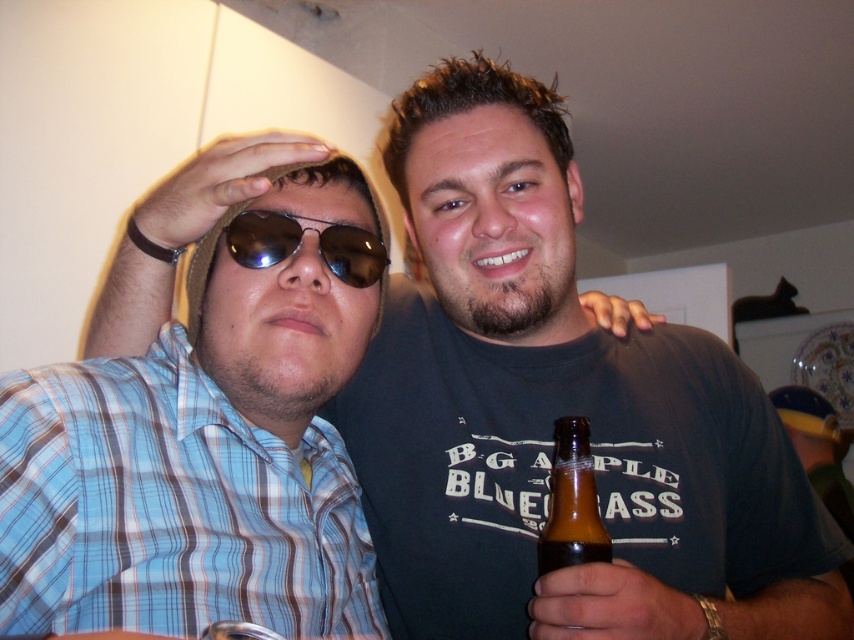
Question: Does brown glass bottle at lower right have a greater width compared to sunglasses at center?

Choices:
 (A) no
 (B) yes

Answer: (A)

Question: Is brown glass bottle at lower right in front of sunglasses at center?

Choices:
 (A) no
 (B) yes

Answer: (B)

Question: Which of the following is the farthest from the observer?

Choices:
 (A) (576, 538)
 (B) (240, 244)

Answer: (B)

Question: Which point appears farthest from the camera in this image?

Choices:
 (A) (326, 256)
 (B) (554, 445)

Answer: (B)

Question: Which of the following is the closest to the observer?

Choices:
 (A) (344, 237)
 (B) (580, 445)

Answer: (B)

Question: Considering the relative positions of brown glass bottle at lower right and sunglasses at center in the image provided, where is brown glass bottle at lower right located with respect to sunglasses at center?

Choices:
 (A) above
 (B) below

Answer: (B)